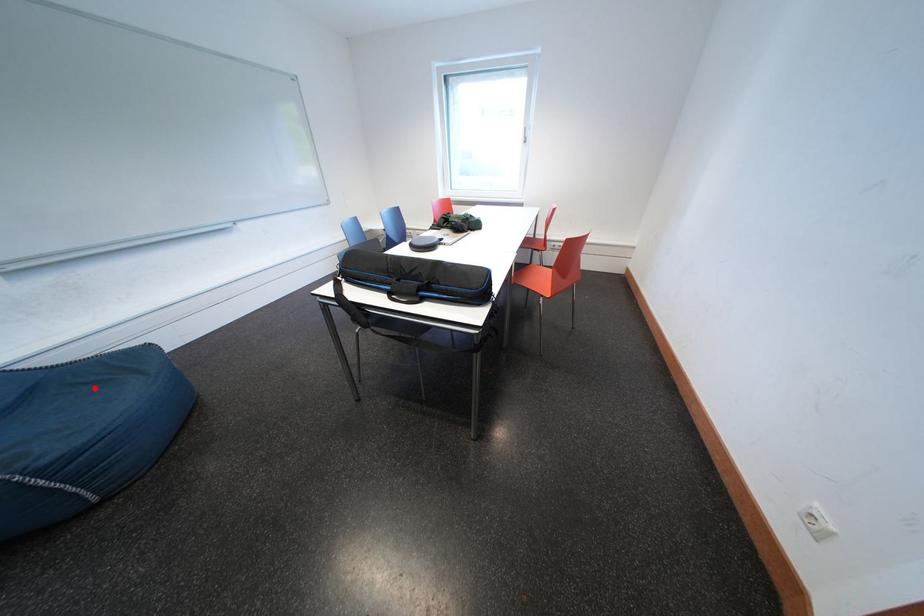
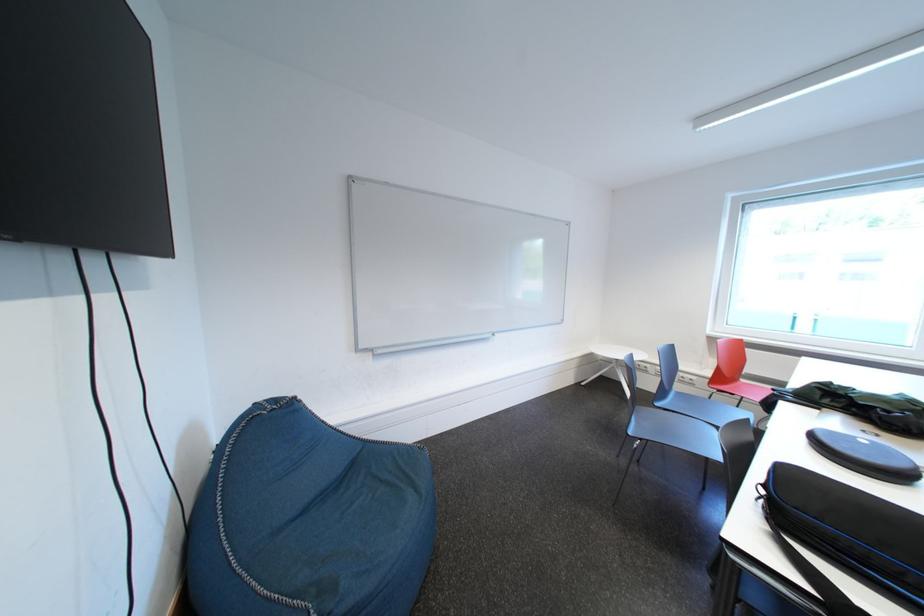
In the second image, find the point that corresponds to the highlighted location in the first image.

(390, 484)